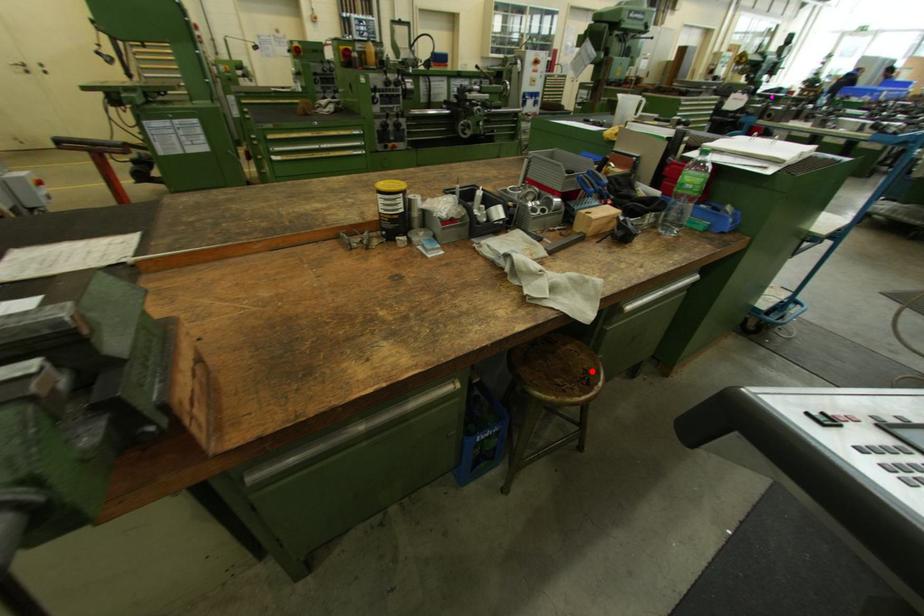
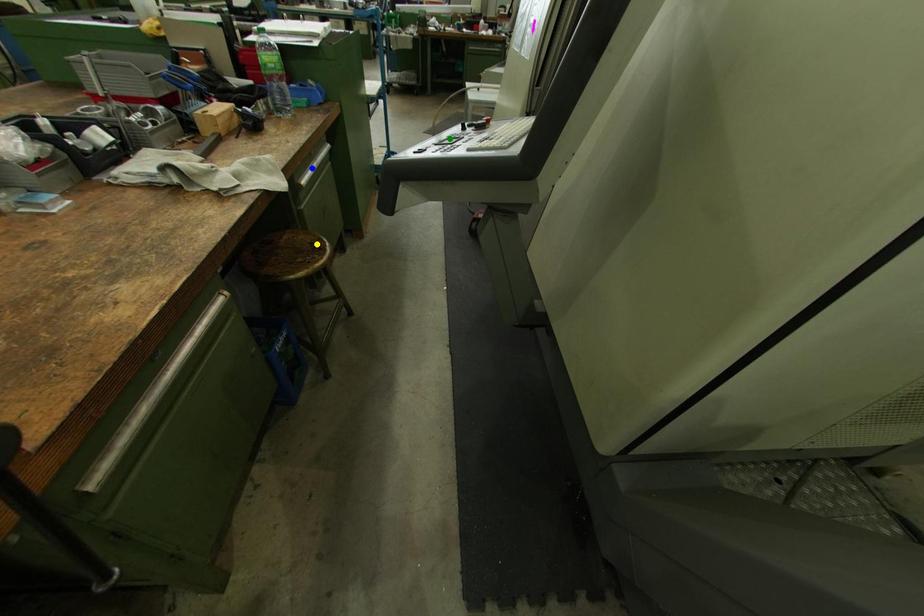
Question: I am providing you with two images of the same scene from different viewpoints. A red point is marked on the first image. You are given multiple points on the second image. Which mark in image 2 goes with the point in image 1?

Choices:
 (A) green point
 (B) yellow point
 (C) blue point

Answer: (B)